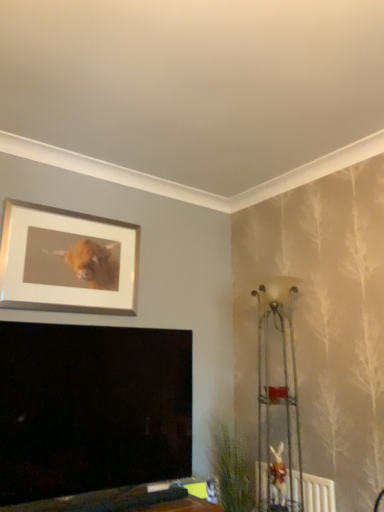
Question: Is the surface of silver/metallic picture frame at upper left in direct contact with metallic wire rack at right?

Choices:
 (A) yes
 (B) no

Answer: (B)

Question: Can you confirm if silver/metallic picture frame at upper left is thinner than metallic wire rack at right?

Choices:
 (A) no
 (B) yes

Answer: (B)

Question: Does silver/metallic picture frame at upper left appear on the left side of metallic wire rack at right?

Choices:
 (A) yes
 (B) no

Answer: (A)

Question: From a real-world perspective, is silver/metallic picture frame at upper left located higher than metallic wire rack at right?

Choices:
 (A) yes
 (B) no

Answer: (A)

Question: Is silver/metallic picture frame at upper left to the right of metallic wire rack at right from the viewer's perspective?

Choices:
 (A) yes
 (B) no

Answer: (B)

Question: Is point (243, 501) positioned closer to the camera than point (299, 489)?

Choices:
 (A) farther
 (B) closer

Answer: (A)

Question: Is green leafy plant at lower right in front of or behind white textured radiator at lower right in the image?

Choices:
 (A) behind
 (B) front

Answer: (A)

Question: Based on their sizes in the image, would you say green leafy plant at lower right is bigger or smaller than white textured radiator at lower right?

Choices:
 (A) big
 (B) small

Answer: (A)

Question: Is green leafy plant at lower right to the left or to the right of white textured radiator at lower right in the image?

Choices:
 (A) left
 (B) right

Answer: (A)

Question: In the image, is silver/metallic picture frame at upper left positioned in front of or behind metallic wire rack at right?

Choices:
 (A) behind
 (B) front

Answer: (A)

Question: Is silver/metallic picture frame at upper left bigger or smaller than metallic wire rack at right?

Choices:
 (A) small
 (B) big

Answer: (A)

Question: Looking at their shapes, would you say silver/metallic picture frame at upper left is wider or thinner than metallic wire rack at right?

Choices:
 (A) wide
 (B) thin

Answer: (B)

Question: In terms of height, does silver/metallic picture frame at upper left look taller or shorter compared to metallic wire rack at right?

Choices:
 (A) tall
 (B) short

Answer: (B)

Question: Based on their sizes in the image, would you say metallic wire rack at right is bigger or smaller than silver/metallic picture frame at upper left?

Choices:
 (A) small
 (B) big

Answer: (B)

Question: Is metallic wire rack at right in front of or behind silver/metallic picture frame at upper left in the image?

Choices:
 (A) behind
 (B) front

Answer: (B)